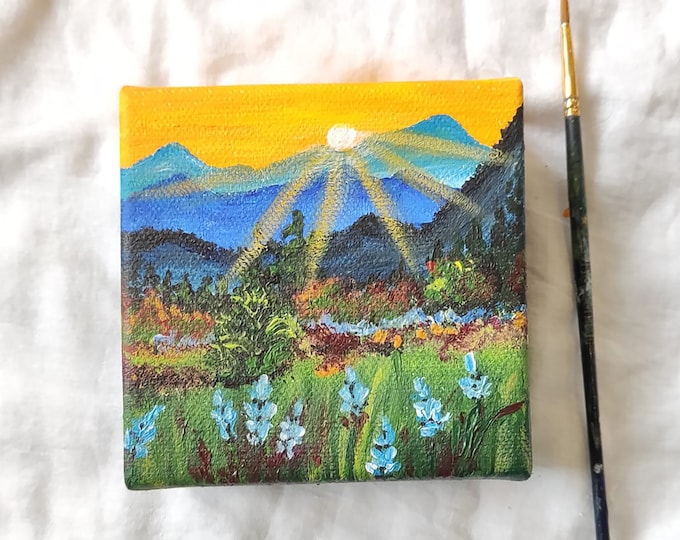
You are a GUI agent. You are given a task and a screenshot of the screen. Output one action in this format:
    pyautogui.click(x=<x>, y=<y>)
    Task: Click on the canvas drawing
    
    Given the screenshot: What is the action you would take?
    pyautogui.click(x=311, y=222)